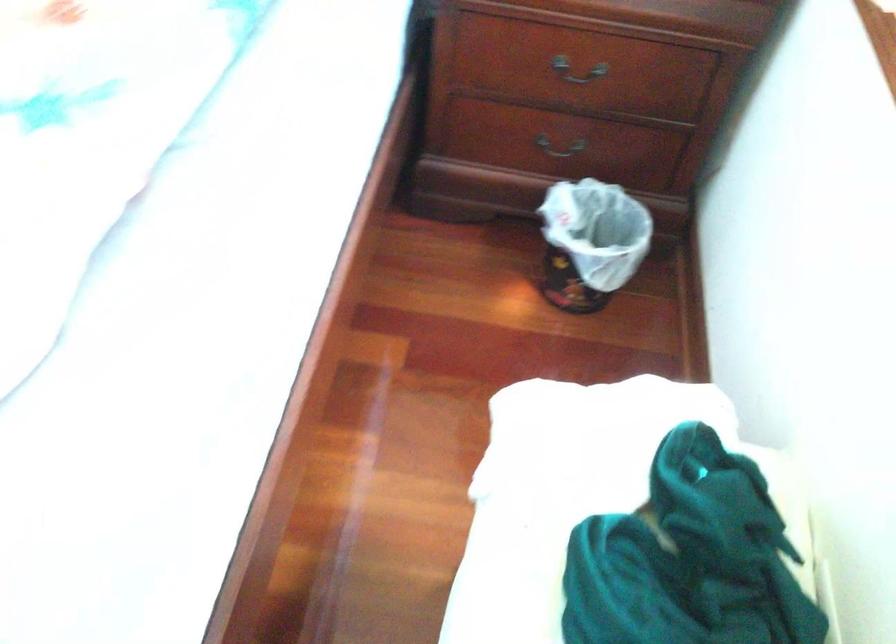
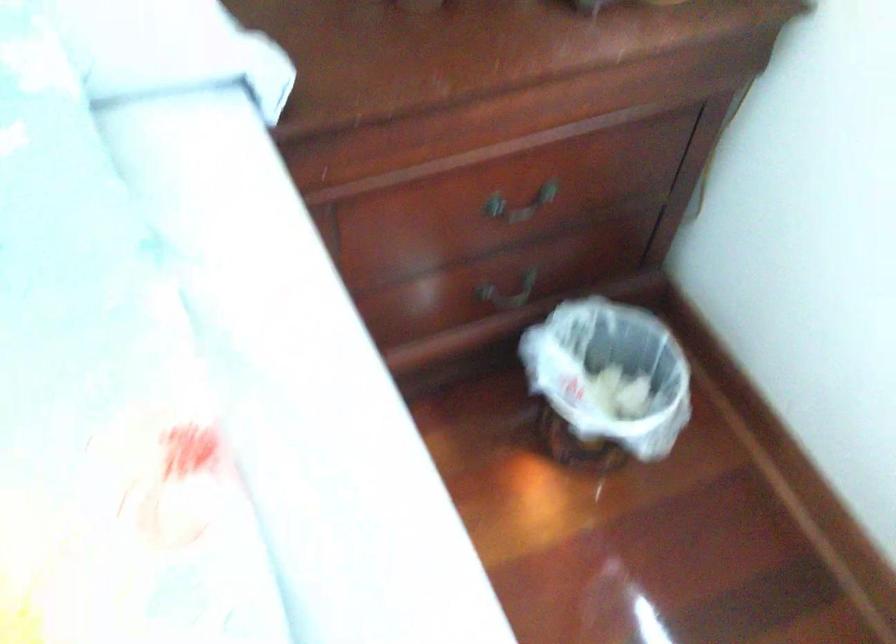
Question: The camera is either moving clockwise (left) or counter-clockwise (right) around the object. The first image is from the beginning of the video and the second image is from the end. Is the camera moving left or right when shooting the video?

Choices:
 (A) Left
 (B) Right

Answer: (A)